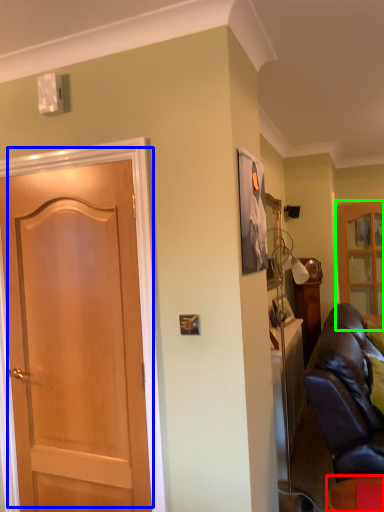
Question: Which object is the farthest from furniture (highlighted by a red box)? Choose among these: door (highlighted by a blue box) or cabinetry (highlighted by a green box).

Choices:
 (A) door
 (B) cabinetry

Answer: (B)